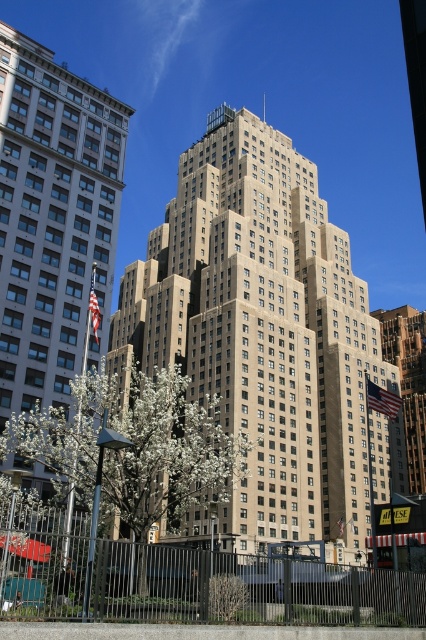
You are standing in the city and want to reach the point marked at coordinates point (x=195, y=589). If your walking speed is 3 feet per second, how many seconds will it take you to reach the point?

The distance between you and the point (x=195, y=589) is 97.90 feet. At a speed of 3 feet per second, it will take approximately 32.63 seconds to reach the point.

From the picture: You are a city planner reviewing this area. You need to install a new security camera that can cover both the metallic wire fence at lower center and the gold textured building at center. Considering their sizes, which object requires a wider field of view to ensure full coverage?

The gold textured building at center requires a wider field of view because it is larger than the metallic wire fence at lower center.

You are a city planner reviewing the layout of the cityscape. Given the coordinates provided for the beige stone building at center, how would you describe its position relative to the other buildings in the scene?

The beige stone building at center is positioned at coordinates approximately 0.522 on the x and 0.622 on the y axis, placing it centrally within the scene as the most prominent feature among the buildings.